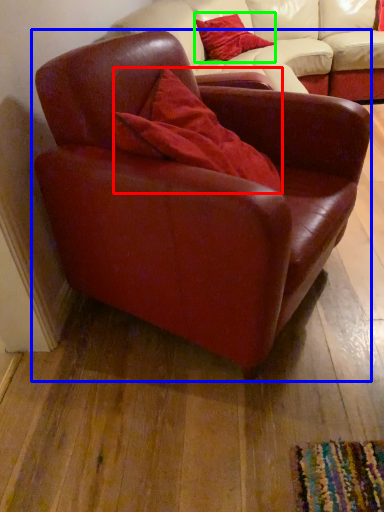
Question: Considering the real-world distances, which object is closest to pillow (highlighted by a red box)? chair (highlighted by a blue box) or pillow (highlighted by a green box).

Choices:
 (A) chair
 (B) pillow

Answer: (A)